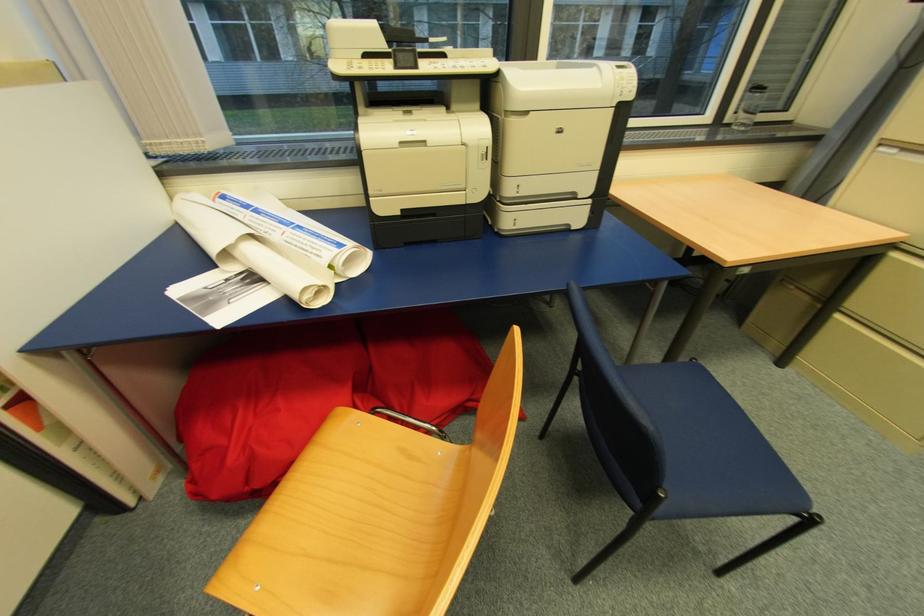
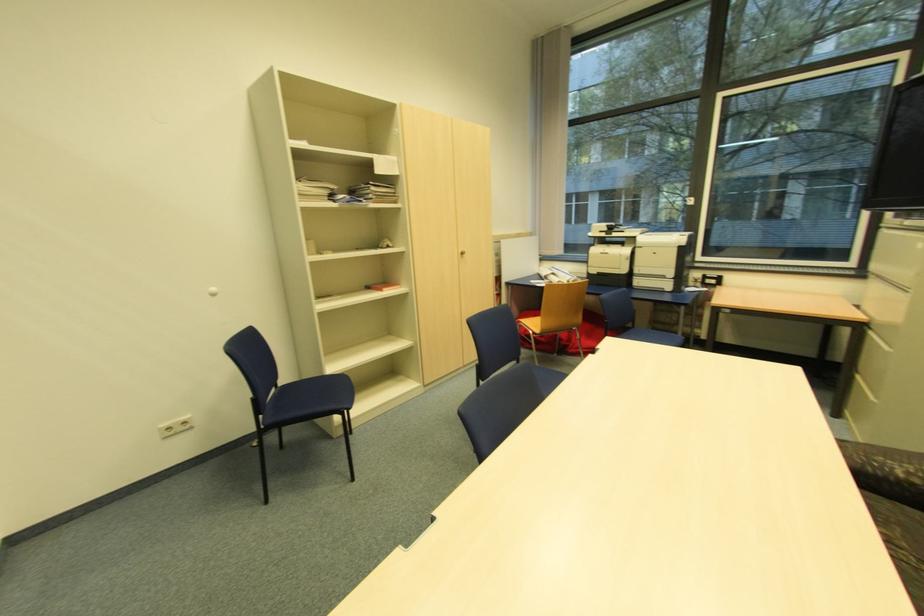
The point at (x=839, y=315) is marked in the first image. Where is the corresponding point in the second image?

(860, 377)